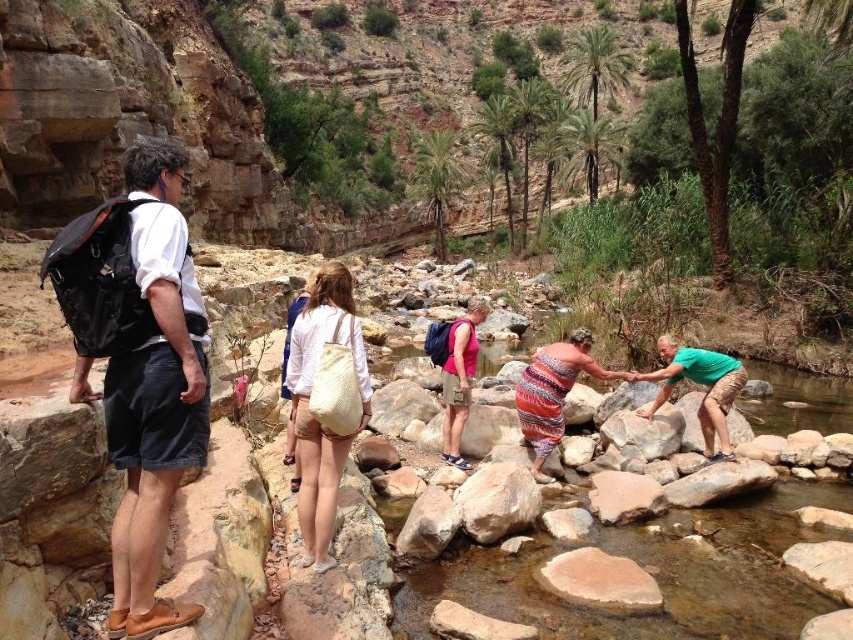
The width and height of the screenshot is (853, 640). Identify the location of black fabric backpack at left. (165, 248).